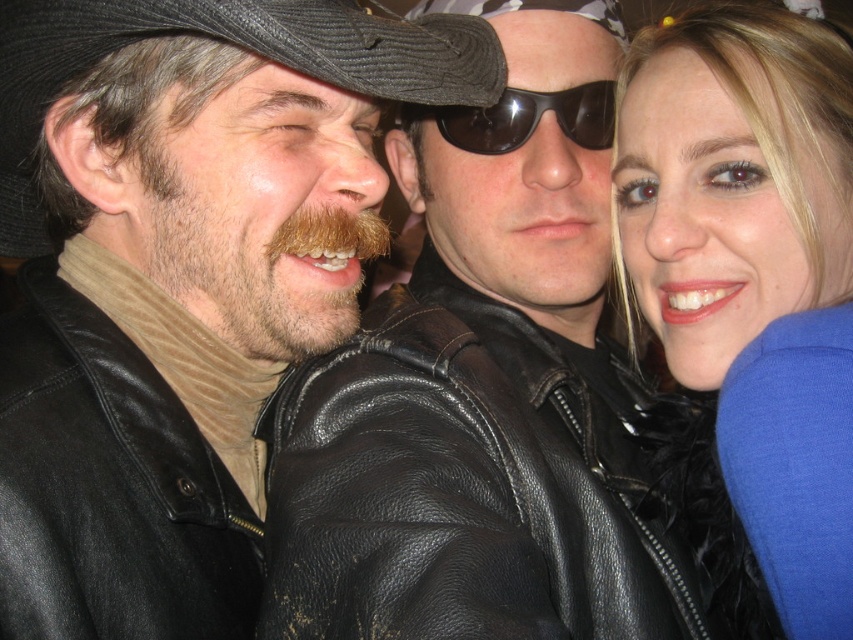
Is black leather jacket at center closer to the viewer compared to black matte sunglasses at center?

Yes, black leather jacket at center is closer to the viewer.

At what (x,y) coordinates should I click in order to perform the action: click on black leather jacket at center. Please return your answer as a coordinate pair (x, y). The height and width of the screenshot is (640, 853). Looking at the image, I should click on (494, 486).

Where is `black corduroy hat at upper left`? This screenshot has width=853, height=640. black corduroy hat at upper left is located at coordinates (233, 44).

Is point (496, 72) farther from viewer compared to point (525, 116)?

No.

Locate an element on the screen. black corduroy hat at upper left is located at coordinates (233, 44).

Looking at this image, between black leather jacket at center and smooth blue scarf at right, which one appears on the left side from the viewer's perspective?

Positioned to the left is black leather jacket at center.

What do you see at coordinates (494, 486) in the screenshot? This screenshot has height=640, width=853. I see `black leather jacket at center` at bounding box center [494, 486].

Is point (386, 596) behind point (815, 54)?

No.

Locate an element on the screen. black leather jacket at center is located at coordinates (494, 486).